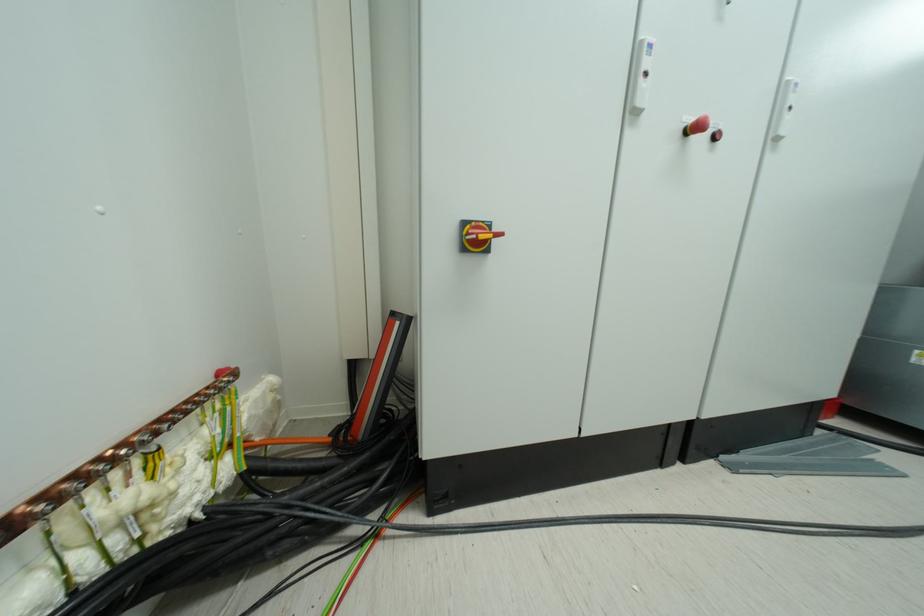
The height and width of the screenshot is (616, 924). In order to click on red emergency button in this screenshot , I will do `click(489, 235)`.